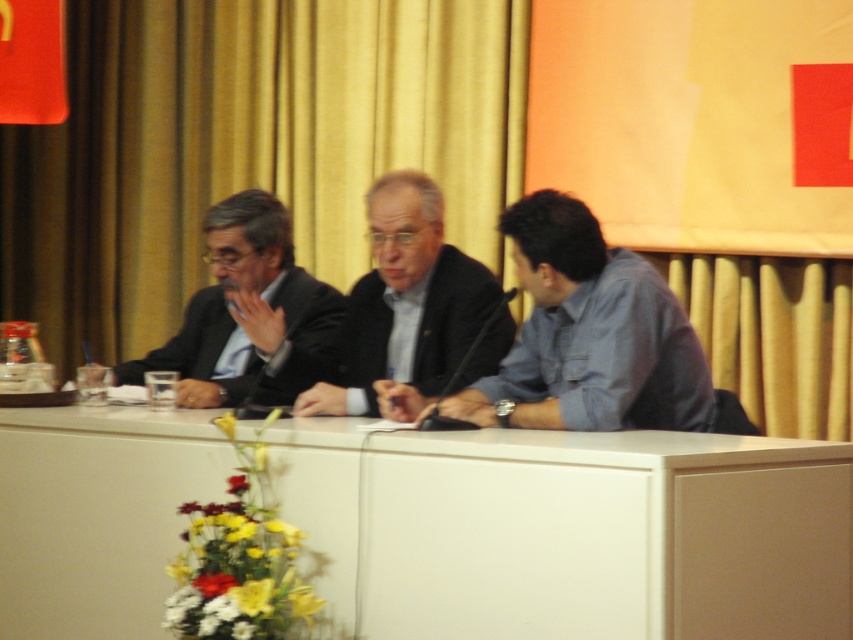
Can you confirm if white glossy table at center is shorter than light blue shirt at center?

Yes.

Does point (392, 448) come behind point (526, 372)?

No, it is not.

Which is behind, point (538, 486) or point (537, 385)?

Positioned behind is point (537, 385).

Find the location of a particular element. white glossy table at center is located at coordinates (567, 531).

Can you confirm if white glossy table at center is bigger than black matte suit at center?

Indeed, white glossy table at center has a larger size compared to black matte suit at center.

Is the position of white glossy table at center less distant than that of black matte suit at center?

Yes, white glossy table at center is in front of black matte suit at center.

The height and width of the screenshot is (640, 853). Find the location of `white glossy table at center`. white glossy table at center is located at coordinates (567, 531).

Is light blue shirt at center positioned behind black matte suit at center?

No, light blue shirt at center is closer to the viewer.

The width and height of the screenshot is (853, 640). What are the coordinates of `light blue shirt at center` in the screenshot? It's located at (582, 337).

The image size is (853, 640). Identify the location of light blue shirt at center. (582, 337).